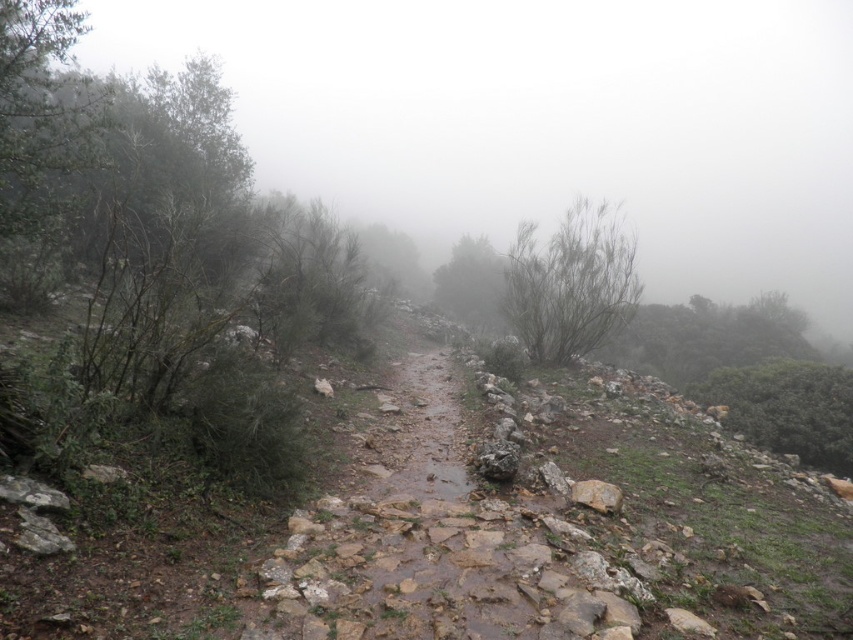
You are a hiker who needs to reach the green matte tree at center. The path is slippery due to recent rain. If you can walk at a safe speed of 1.5 meters per second, how many seconds will it take you to reach the tree?

The distance between you and the green matte tree at center is 23.12 meters. At a safe speed of 1.5 meters per second, it will take approximately 15.4 seconds to reach the tree.

You are a hiker trying to navigate the misty path. You notice two bushes ahead of you, the green leafy bush at upper right and the green matte bush at center. Which bush is wider?

The green leafy bush at upper right is wider than the green matte bush at center.

You are a hiker navigating a misty, rugged path. You see the green matte tree at center. Based on its position, can you estimate its coordinates in the image?

The green matte tree at center is located at coordinates approximately 0.448 on the x axis and 0.555 on the y axis.